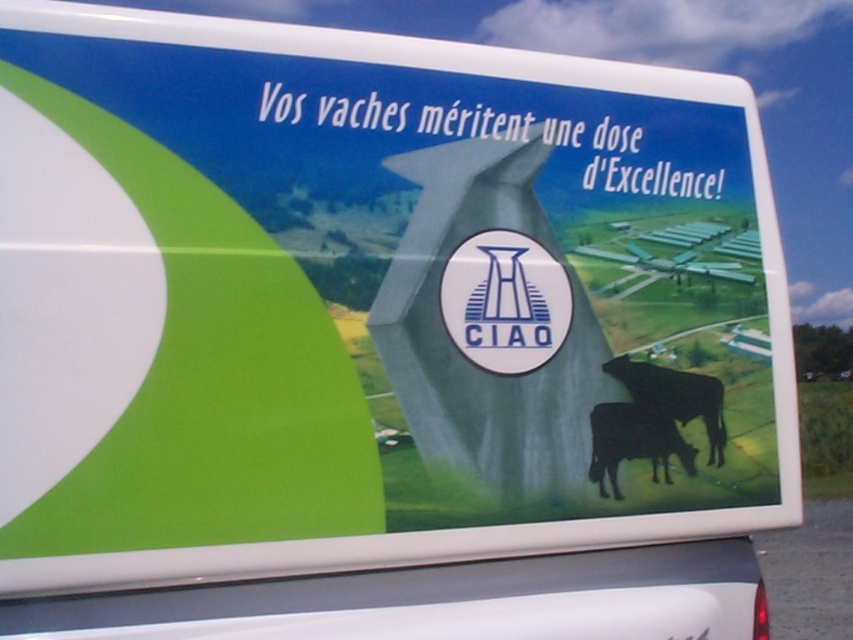
Where is the black glossy bull at lower right located on the image coordinate system?

The black glossy bull at lower right is located at point coordinates of [633,442].